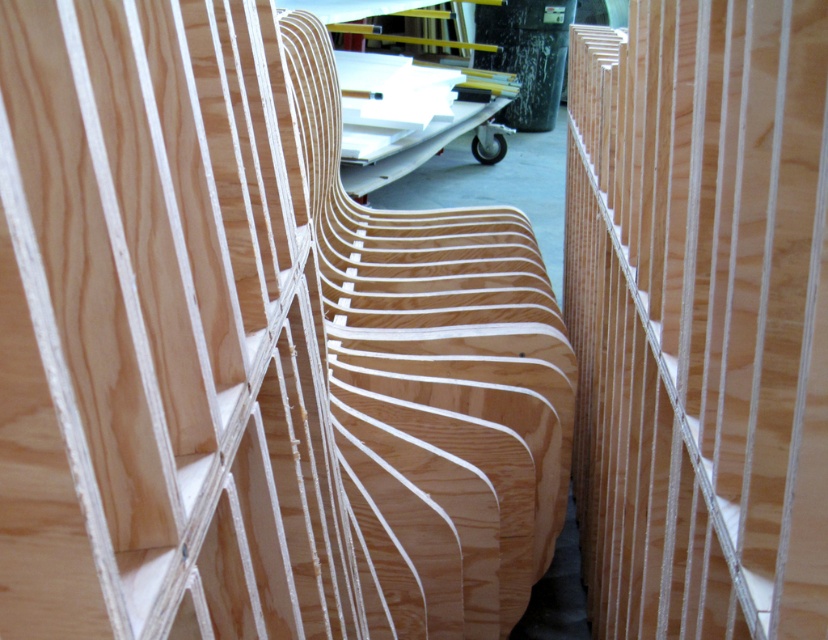
Where is the natural wood chair at center located in the image?

The natural wood chair at center is located at point (251, 353) in the image.

You are an interior designer planning to place the natural wood chair at center and the natural wood plywood at center in a small room. Considering their sizes, which one might be more challenging to fit into tight spaces?

The natural wood chair at center is larger in size than the natural wood plywood at center, so it would be more challenging to fit into tight spaces.

From the picture: You are an architect examining the wooden structures in the image. You notice two points labeled as point 1 and point 2. Point 1 is at coordinate [561,362] and point 2 is at [609,141]. Based on their positions, which point is closer to you?

Point 1 at coordinate [561,362] is closer to you because it is further to the viewer than point 2 at [609,141].